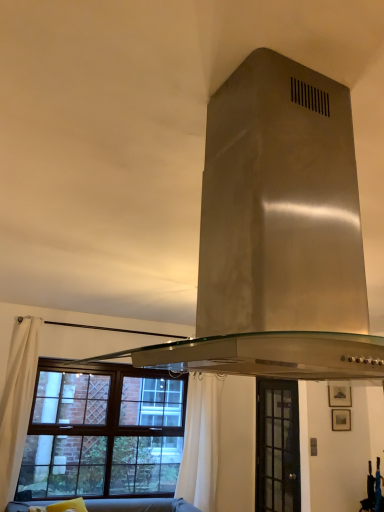
This screenshot has height=512, width=384. In order to click on white fabric curtain at lower center, which is the 2th curtain in left-to-right order in this screenshot , I will do `click(201, 442)`.

Locate an element on the screen. stainless steel exhaust hood at center is located at coordinates (277, 234).

Where is `white fabric curtain at left, which is counted as the 2th curtain, starting from the right`? This screenshot has width=384, height=512. white fabric curtain at left, which is counted as the 2th curtain, starting from the right is located at coordinates [17, 402].

In order to face brown wooden window at lower left, acting as the first window starting from the left, should I rotate leftwards or rightwards?

Rotate your view left by about 10.479°.

Describe the element at coordinates (277, 446) in the screenshot. Image resolution: width=384 pixels, height=512 pixels. I see `clear glass door at center, which ranks as the 1th window in right-to-left order` at that location.

The width and height of the screenshot is (384, 512). I want to click on white fabric curtain at lower center, arranged as the second curtain when viewed from the front, so click(201, 442).

Which object is thinner, white fabric curtain at lower center, arranged as the second curtain when viewed from the front, or stainless steel exhaust hood at center?

white fabric curtain at lower center, arranged as the second curtain when viewed from the front, is thinner.

From a real-world perspective, which is physically below, white fabric curtain at lower center, which ranks as the 1th curtain in right-to-left order, or stainless steel exhaust hood at center?

white fabric curtain at lower center, which ranks as the 1th curtain in right-to-left order, is physically lower.

From the image's perspective, which is below, white fabric curtain at lower center, which is the 2th curtain in left-to-right order, or stainless steel exhaust hood at center?

white fabric curtain at lower center, which is the 2th curtain in left-to-right order, from the image's perspective.

Consider the image. Considering the sizes of objects white fabric curtain at lower center, arranged as the second curtain when viewed from the front, and stainless steel exhaust hood at center in the image provided, who is taller, white fabric curtain at lower center, arranged as the second curtain when viewed from the front, or stainless steel exhaust hood at center?

Standing taller between the two is white fabric curtain at lower center, arranged as the second curtain when viewed from the front.

Based on the photo, is white fabric curtain at left, which is the 2th curtain from back to front, positioned beyond the bounds of stainless steel exhaust hood at center?

Yes.

From a real-world perspective, who is located lower, white fabric curtain at left, which is counted as the 2th curtain, starting from the right, or stainless steel exhaust hood at center?

In real-world perspective, white fabric curtain at left, which is counted as the 2th curtain, starting from the right, is lower.

What are the coordinates of `exhaust hood in front of the white fabric curtain at left, which is the 2th curtain from back to front` in the screenshot? It's located at (277, 234).

Which of these two, clear glass door at center, which ranks as the 1th window in right-to-left order, or white fabric curtain at lower center, which is the 2th curtain in left-to-right order, is thinner?

Thinner between the two is clear glass door at center, which ranks as the 1th window in right-to-left order.

From the image's perspective, is clear glass door at center, which is counted as the second window, starting from the left, beneath white fabric curtain at lower center, positioned as the 1th curtain in back-to-front order?

Yes.

From a real-world perspective, is clear glass door at center, which is counted as the second window, starting from the left, located beneath white fabric curtain at lower center, which ranks as the 1th curtain in right-to-left order?

Yes.

Is stainless steel exhaust hood at center situated inside brown wooden window at lower left, marked as the 2th window in a right-to-left arrangement, or outside?

stainless steel exhaust hood at center lies outside brown wooden window at lower left, marked as the 2th window in a right-to-left arrangement.

From a real-world perspective, who is located higher, stainless steel exhaust hood at center or brown wooden window at lower left, acting as the first window starting from the left?

In real-world perspective, stainless steel exhaust hood at center is above.

In the image, is stainless steel exhaust hood at center positioned in front of or behind brown wooden window at lower left, marked as the 2th window in a right-to-left arrangement?

stainless steel exhaust hood at center is in front of brown wooden window at lower left, marked as the 2th window in a right-to-left arrangement.

Considering the points (324, 112) and (89, 387), which point is behind, point (324, 112) or point (89, 387)?

The point (89, 387) is more distant.

From the image's perspective, is stainless steel exhaust hood at center located beneath white fabric curtain at lower center, arranged as the second curtain when viewed from the front?

No, from the image's perspective, stainless steel exhaust hood at center is not below white fabric curtain at lower center, arranged as the second curtain when viewed from the front.

Could you measure the distance between stainless steel exhaust hood at center and white fabric curtain at lower center, arranged as the second curtain when viewed from the front?

The distance of stainless steel exhaust hood at center from white fabric curtain at lower center, arranged as the second curtain when viewed from the front, is 10.04 feet.

Which curtain is the 2nd one when counting from the back of the stainless steel exhaust hood at center? Please provide its 2D coordinates.

[(201, 442)]

Does stainless steel exhaust hood at center turn towards white fabric curtain at lower center, positioned as the 1th curtain in back-to-front order?

No.

Considering the relative positions of clear glass door at center, which is counted as the second window, starting from the left, and white fabric curtain at left, which is counted as the 2th curtain, starting from the right, in the image provided, is clear glass door at center, which is counted as the second window, starting from the left, to the right of white fabric curtain at left, which is counted as the 2th curtain, starting from the right, from the viewer's perspective?

Correct, you'll find clear glass door at center, which is counted as the second window, starting from the left, to the right of white fabric curtain at left, which is counted as the 2th curtain, starting from the right.

In the scene shown: From a real-world perspective, which object stands above the other?

In real-world perspective, white fabric curtain at left, which is the 2th curtain from back to front, is above.

Is there a large distance between clear glass door at center, which is counted as the second window, starting from the left, and white fabric curtain at left, which is the first curtain in left-to-right order?

Yes.

How different are the orientations of clear glass door at center, which ranks as the 1th window in right-to-left order, and soft gray fabric couch at lower center in degrees?

The angular difference between clear glass door at center, which ranks as the 1th window in right-to-left order, and soft gray fabric couch at lower center is 90.1 degrees.

Is clear glass door at center, which is counted as the second window, starting from the left, not within soft gray fabric couch at lower center?

Yes, clear glass door at center, which is counted as the second window, starting from the left, is outside of soft gray fabric couch at lower center.

Which of these two, clear glass door at center, which is counted as the second window, starting from the left, or soft gray fabric couch at lower center, is wider?

Wider between the two is soft gray fabric couch at lower center.

Between clear glass door at center, which is counted as the second window, starting from the left, and soft gray fabric couch at lower center, which one has less height?

soft gray fabric couch at lower center.

Locate an element on the screen. exhaust hood that is on the right side of white fabric curtain at lower center, arranged as the second curtain when viewed from the front is located at coordinates (277, 234).

Starting from the stainless steel exhaust hood at center, which curtain is the 2nd one to the left? Please provide its 2D coordinates.

[(17, 402)]

From the image, which object appears to be nearer to white fabric curtain at left, marked as the 1th curtain in a front-to-back arrangement, white fabric curtain at lower center, positioned as the 1th curtain in back-to-front order, or stainless steel exhaust hood at center?

white fabric curtain at lower center, positioned as the 1th curtain in back-to-front order, is positioned closer to the anchor white fabric curtain at left, marked as the 1th curtain in a front-to-back arrangement.

Which object lies further to the anchor point clear glass door at center, which ranks as the 1th window in right-to-left order, white fabric curtain at left, which is the first curtain in left-to-right order, or brown wooden window at lower left, acting as the first window starting from the left?

white fabric curtain at left, which is the first curtain in left-to-right order, is positioned further to the anchor clear glass door at center, which ranks as the 1th window in right-to-left order.

From the image, which object appears to be farther from clear glass door at center, which is counted as the second window, starting from the left, stainless steel exhaust hood at center or white fabric curtain at lower center, which is the 2th curtain in left-to-right order?

Based on the image, stainless steel exhaust hood at center appears to be further to clear glass door at center, which is counted as the second window, starting from the left.

Looking at the image, which one is located closer to stainless steel exhaust hood at center, clear glass door at center, which is counted as the second window, starting from the left, or brown wooden window at lower left, acting as the first window starting from the left?

clear glass door at center, which is counted as the second window, starting from the left.

From the image, which object appears to be farther from white fabric curtain at left, marked as the 1th curtain in a front-to-back arrangement, white fabric curtain at lower center, positioned as the 1th curtain in back-to-front order, or clear glass door at center, which is counted as the second window, starting from the left?

clear glass door at center, which is counted as the second window, starting from the left, lies further to white fabric curtain at left, marked as the 1th curtain in a front-to-back arrangement, than the other object.

Which object lies nearer to the anchor point soft gray fabric couch at lower center, white fabric curtain at left, which is counted as the 2th curtain, starting from the right, or white fabric curtain at lower center, which is the 2th curtain in left-to-right order?

white fabric curtain at lower center, which is the 2th curtain in left-to-right order.

Looking at the image, which one is located closer to white fabric curtain at lower center, which is the 2th curtain in left-to-right order, soft gray fabric couch at lower center or white fabric curtain at left, marked as the 1th curtain in a front-to-back arrangement?

Based on the image, soft gray fabric couch at lower center appears to be nearer to white fabric curtain at lower center, which is the 2th curtain in left-to-right order.

Based on the photo, estimate the real-world distances between objects in this image. Which object is further from soft gray fabric couch at lower center, brown wooden window at lower left, acting as the first window starting from the left, or white fabric curtain at left, which is the first curtain in left-to-right order?

The object further to soft gray fabric couch at lower center is white fabric curtain at left, which is the first curtain in left-to-right order.

Image resolution: width=384 pixels, height=512 pixels. I want to click on studio couch positioned between stainless steel exhaust hood at center and white fabric curtain at lower center, positioned as the 1th curtain in back-to-front order, from near to far, so click(140, 505).

Where is `curtain located between stainless steel exhaust hood at center and soft gray fabric couch at lower center in the depth direction`? The image size is (384, 512). curtain located between stainless steel exhaust hood at center and soft gray fabric couch at lower center in the depth direction is located at coordinates (17, 402).

The image size is (384, 512). Find the location of `studio couch between stainless steel exhaust hood at center and clear glass door at center, which is counted as the second window, starting from the left, from front to back`. studio couch between stainless steel exhaust hood at center and clear glass door at center, which is counted as the second window, starting from the left, from front to back is located at coordinates (140, 505).

You are a GUI agent. You are given a task and a screenshot of the screen. Output one action in this format:
    pyautogui.click(x=<x>, y=<y>)
    Task: Click on the curtain located between soft gray fabric couch at lower center and clear glass door at center, which is counted as the second window, starting from the left, in the left-right direction
    Image resolution: width=384 pixels, height=512 pixels.
    Given the screenshot: What is the action you would take?
    pyautogui.click(x=201, y=442)